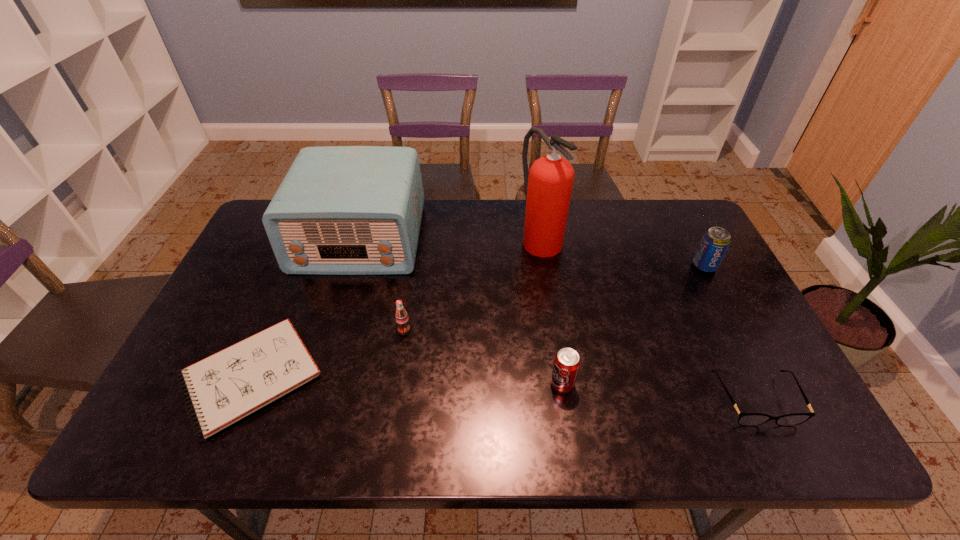
Image resolution: width=960 pixels, height=540 pixels. What are the coordinates of `vacant space located on the front of the second nearest soda` in the screenshot? It's located at (400, 358).

Where is `vacant space situated 0.050m on the back of the second soda from left to right`? This screenshot has height=540, width=960. vacant space situated 0.050m on the back of the second soda from left to right is located at coordinates (558, 356).

The height and width of the screenshot is (540, 960). In order to click on vacant space located 0.270m on the right of the notepad in this screenshot , I will do `click(435, 377)`.

The image size is (960, 540). Identify the location of fire extinguisher present at the far edge. (548, 186).

Locate an element on the screen. radio receiver positioned at the far edge is located at coordinates (340, 210).

Find the location of a particular element. spectacles that is at the near edge is located at coordinates (745, 419).

The height and width of the screenshot is (540, 960). In order to click on notepad present at the near edge in this screenshot , I will do `click(225, 387)`.

Identify the location of radio receiver present at the left edge. (340, 210).

Locate an element on the screen. notepad present at the left edge is located at coordinates (225, 387).

The height and width of the screenshot is (540, 960). Find the location of `soda present at the right edge`. soda present at the right edge is located at coordinates pos(715,242).